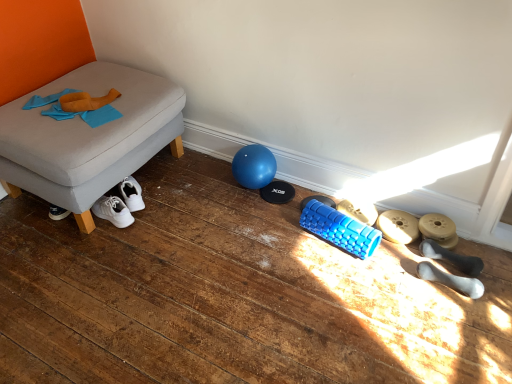
The width and height of the screenshot is (512, 384). In order to click on empty space that is in between gray fabric ottoman at left and matte gray dumbbell at lower right, which appears as the 4th footwear when viewed from the front in this screenshot , I will do `click(220, 216)`.